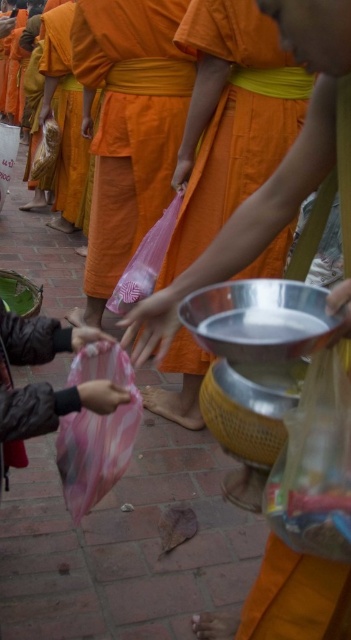
Question: Which object is positioned farthest from the pink fabric bag at lower center?

Choices:
 (A) orange cloth at center
 (B) smooth plastic bag at center
 (C) pink fabric bag at lower left

Answer: (A)

Question: Which is farther from the smooth plastic bag at center?

Choices:
 (A) orange matte/soft robe at center
 (B) orange cloth at center
 (C) pink fabric bag at lower left

Answer: (B)

Question: Can you confirm if orange cloth at left is bigger than smooth plastic bag at center?

Choices:
 (A) yes
 (B) no

Answer: (A)

Question: Which object is the farthest from the orange matte/soft robe at center?

Choices:
 (A) pink fabric bag at lower center
 (B) pink fabric bag at lower left
 (C) orange cloth at center

Answer: (A)

Question: Does orange cloth at left appear over pink fabric bag at lower left?

Choices:
 (A) yes
 (B) no

Answer: (A)

Question: Does orange matte/soft robe at center appear on the right side of pink fabric hand at center?

Choices:
 (A) no
 (B) yes

Answer: (B)